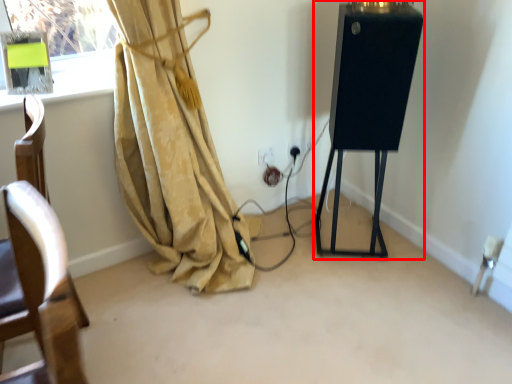
Question: From the image, what is the correct spatial relationship of easel (annotated by the red box) in relation to electric outlet?

Choices:
 (A) left
 (B) right

Answer: (B)